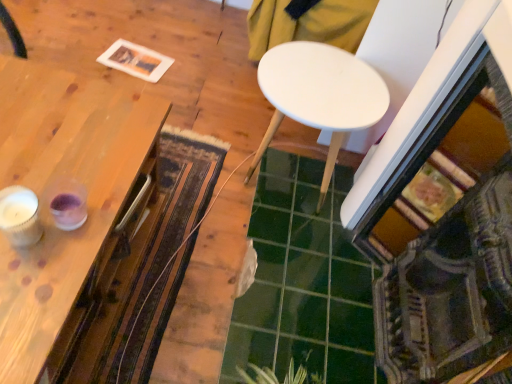
At what (x,y) coordinates should I click in order to perform the action: click on vacant space underneath green glossy tile at center (from a real-world perspective). Please return your answer as a coordinate pair (x, y). Looking at the image, I should click on (289, 274).